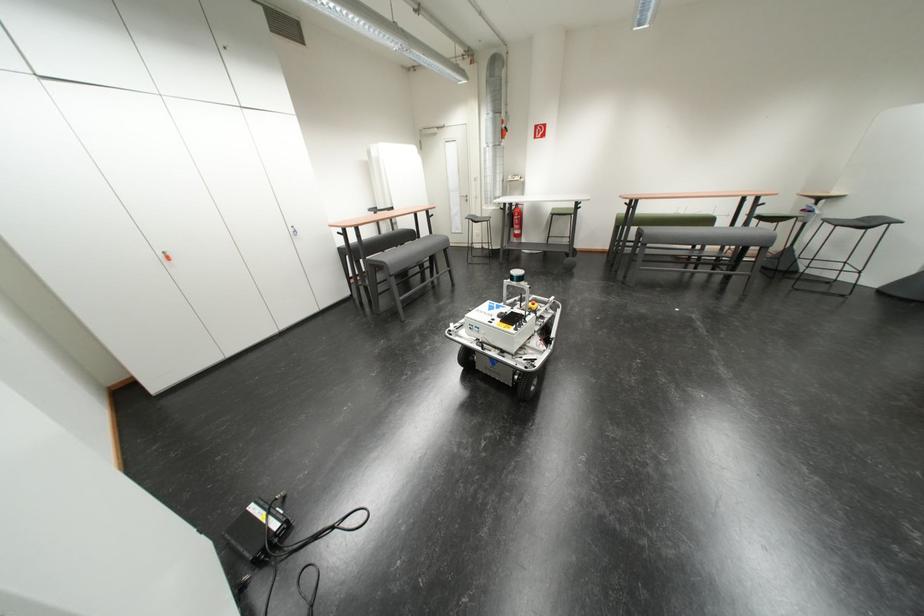
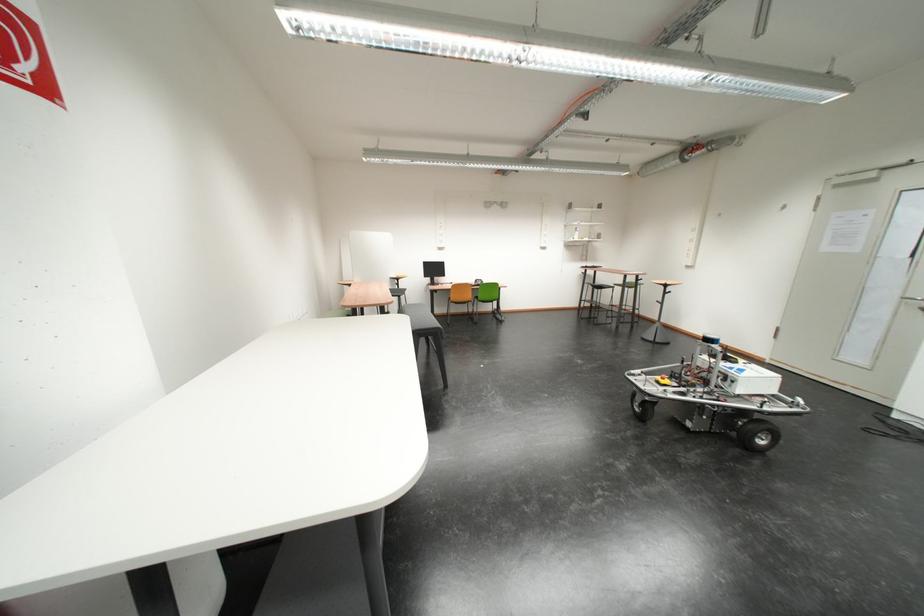
Question: I am providing you with two images of the same scene from different viewpoints. Please identify which objects are invisible in image2.

Choices:
 (A) sofa sitting surface
 (B) small soap bar
 (C) white door handle
 (D) dark gray stool surface

Answer: (A)